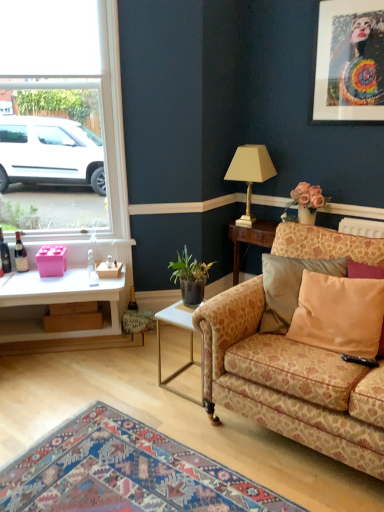
Where is `free point in front of matte glass bottle at left, the second bottle when ordered from right to left`? Image resolution: width=384 pixels, height=512 pixels. free point in front of matte glass bottle at left, the second bottle when ordered from right to left is located at coordinates (18, 279).